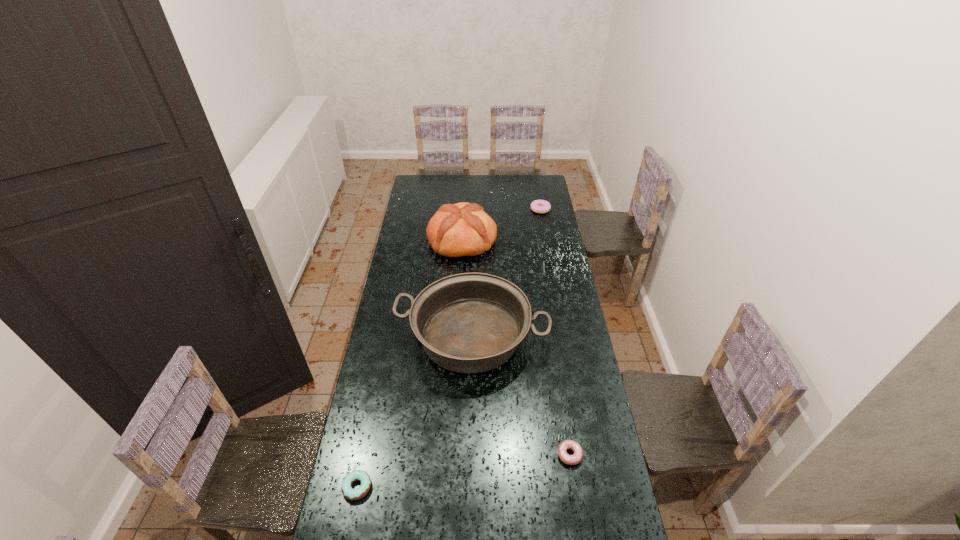
Locate an element on the screen. This screenshot has height=540, width=960. free region at the far right corner is located at coordinates (546, 180).

Where is `vacant space that is in between the nearest doughnut and the second nearest doughnut`? The width and height of the screenshot is (960, 540). vacant space that is in between the nearest doughnut and the second nearest doughnut is located at coordinates (464, 471).

Where is `empty space that is in between the tallest doughnut and the second nearest doughnut`? Image resolution: width=960 pixels, height=540 pixels. empty space that is in between the tallest doughnut and the second nearest doughnut is located at coordinates (555, 332).

Identify the location of vacant space that is in between the pan and the fourth farthest object. This screenshot has width=960, height=540. (520, 396).

The image size is (960, 540). What are the coordinates of `vacant area between the nearest object and the bread` in the screenshot? It's located at (410, 364).

Identify the location of vacant point located between the bread and the farthest object. This screenshot has width=960, height=540. (501, 225).

Locate an element on the screen. free spot between the bread and the nearest doughnut is located at coordinates (410, 364).

Locate an element on the screen. free point between the nearest doughnut and the second nearest object is located at coordinates (464, 471).

Locate which object ranks in proximity to the fourth shortest object. Please provide its 2D coordinates. Your answer should be formatted as a tuple, i.e. [(x, y)], where the tuple contains the x and y coordinates of a point satisfying the conditions above.

[(574, 459)]

The image size is (960, 540). I want to click on the fourth closest object to the second farthest doughnut, so click(x=538, y=206).